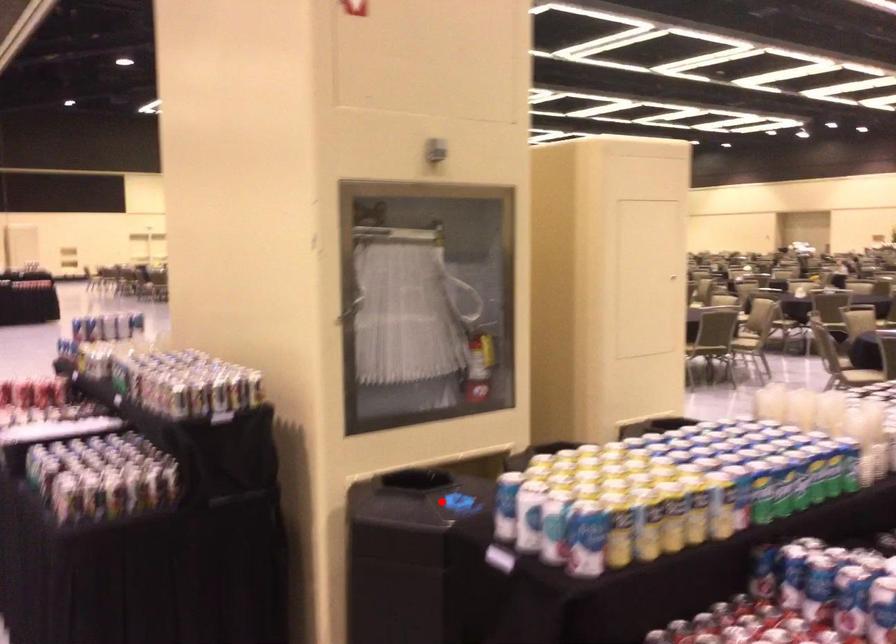
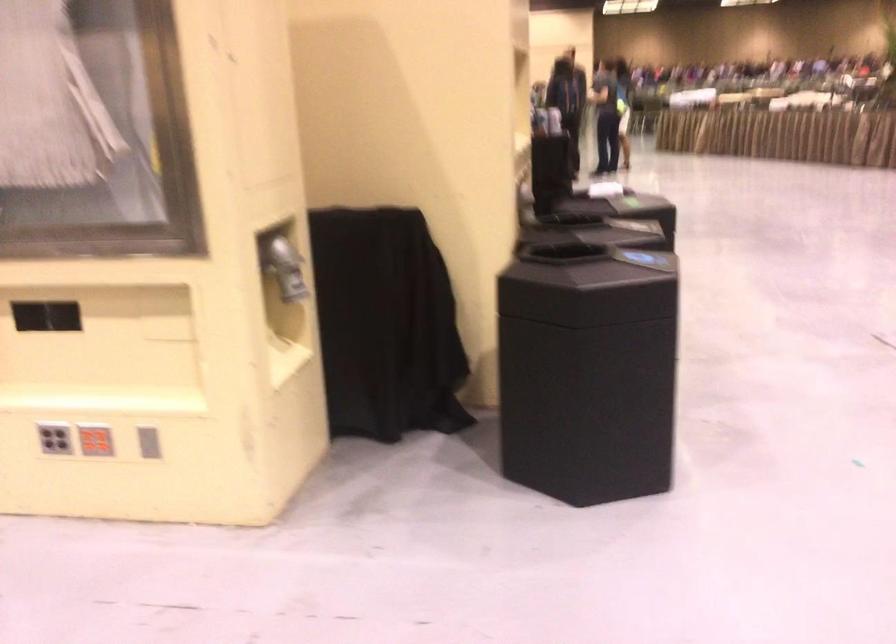
Question: I am providing you with two images of the same scene from different viewpoints. A red point is marked on the first image. Is the red point's position out of view in image 2?

Choices:
 (A) Yes
 (B) No

Answer: (A)